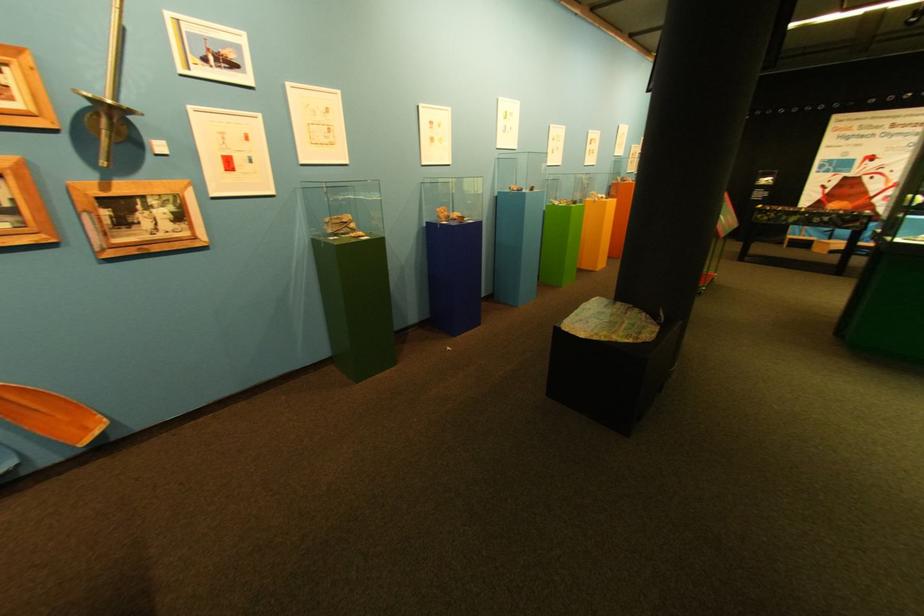
Identify the location of wooden oar blade. This screenshot has width=924, height=616. (50, 415).